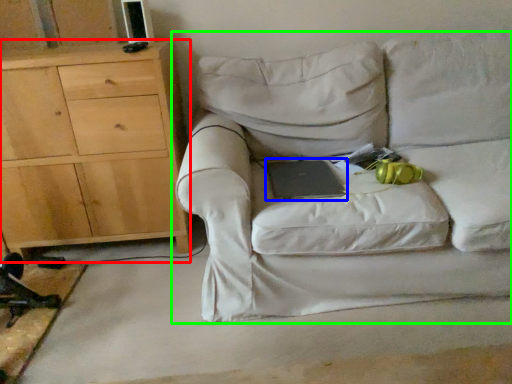
Question: Which object is positioned closest to chest of drawers (highlighted by a red box)? Select from paperback book (highlighted by a blue box) and studio couch (highlighted by a green box).

Choices:
 (A) paperback book
 (B) studio couch

Answer: (B)